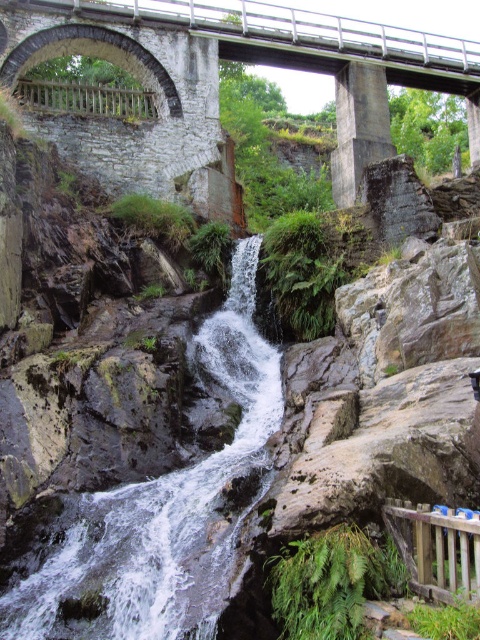
At what (x,y) coordinates should I click in order to perform the action: click on white frothy water at center. Please return your answer as a coordinate pair (x, y). Looking at the image, I should click on pos(163,508).

How much distance is there between white frothy water at center and stone bridge at upper center?

white frothy water at center and stone bridge at upper center are 163.23 feet apart from each other.

Where is `white frothy water at center`? white frothy water at center is located at coordinates (163, 508).

This screenshot has height=640, width=480. I want to click on white frothy water at center, so click(163, 508).